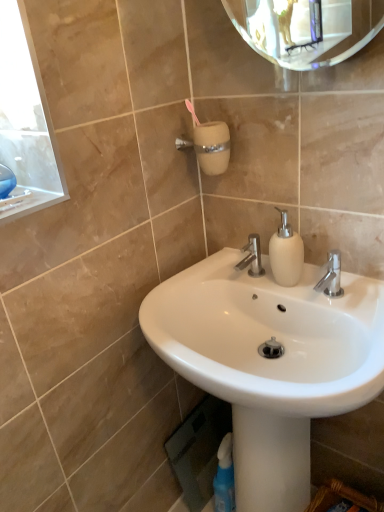
Locate an element on the screen. The image size is (384, 512). free space to the left of white matte soap dispenser at center is located at coordinates pyautogui.click(x=237, y=283).